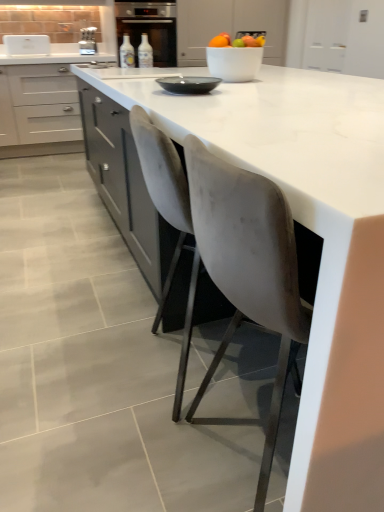
Measure the distance between white glossy toaster at upper left and camera.

They are 13.05 feet apart.

The image size is (384, 512). I want to click on matte gray cabinets at left, so click(x=41, y=102).

This screenshot has width=384, height=512. Describe the element at coordinates (145, 52) in the screenshot. I see `translucent glass bottle at center, the first bottle viewed from the right` at that location.

What do you see at coordinates (317, 234) in the screenshot?
I see `white marble countertop at center` at bounding box center [317, 234].

Describe the element at coordinates (234, 62) in the screenshot. The height and width of the screenshot is (512, 384). I see `white glossy bowl at upper center` at that location.

The width and height of the screenshot is (384, 512). What are the coordinates of `translucent glass bottle at center, the first bottle positioned from the left` in the screenshot? It's located at (127, 53).

Locate an element on the screen. white glossy toaster at upper left is located at coordinates (27, 44).

From a real-world perspective, is matte gray cabinets at left located higher than white glossy bowl at upper center?

Actually, matte gray cabinets at left is physically below white glossy bowl at upper center in the real world.

Does matte gray cabinets at left have a greater height compared to white glossy bowl at upper center?

Indeed, matte gray cabinets at left has a greater height compared to white glossy bowl at upper center.

Consider the image. How distant is matte gray cabinets at left from white glossy bowl at upper center?

matte gray cabinets at left and white glossy bowl at upper center are 8.83 feet apart from each other.

Is matte gray cabinets at left oriented towards white glossy bowl at upper center?

Yes, matte gray cabinets at left is facing white glossy bowl at upper center.

From the image's perspective, which one is positioned lower, matte gray cabinets at left or white glossy toaster at upper left?

matte gray cabinets at left, from the image's perspective.

Considering the positions of objects matte gray cabinets at left and white glossy toaster at upper left in the image provided, who is more to the left, matte gray cabinets at left or white glossy toaster at upper left?

From the viewer's perspective, white glossy toaster at upper left appears more on the left side.

Is there a large distance between matte gray cabinets at left and white glossy toaster at upper left?

matte gray cabinets at left is near white glossy toaster at upper left, not far away.

Which of these two, matte gray cabinets at left or white glossy toaster at upper left, stands taller?

matte gray cabinets at left is taller.

Does translucent glass bottle at center, the first bottle positioned from the left, lie in front of matte gray cabinets at left?

That is True.

Consider the image. Is translucent glass bottle at center, the first bottle positioned from the left, turned away from matte gray cabinets at left?

Yes.

Is translucent glass bottle at center, the first bottle positioned from the left, to the right of matte gray cabinets at left from the viewer's perspective?

Yes.

Looking at this image, from a real-world perspective, is translucent glass bottle at center, the first bottle positioned from the left, physically above matte gray cabinets at left?

Indeed, from a real-world perspective, translucent glass bottle at center, the first bottle positioned from the left, stands above matte gray cabinets at left.

Is white marble countertop at center to the right of translucent glass bottle at center, the second bottle from the right, from the viewer's perspective?

Yes, white marble countertop at center is to the right of translucent glass bottle at center, the second bottle from the right.

Considering the relative sizes of white marble countertop at center and translucent glass bottle at center, the first bottle positioned from the left, in the image provided, is white marble countertop at center smaller than translucent glass bottle at center, the first bottle positioned from the left,?

No.

Considering the sizes of objects white marble countertop at center and translucent glass bottle at center, the second bottle from the right, in the image provided, who is shorter, white marble countertop at center or translucent glass bottle at center, the second bottle from the right,?

translucent glass bottle at center, the second bottle from the right, is shorter.

From the image's perspective, between white glossy toaster at upper left and metallic silver toaster at upper left, who is located below?

From the image's view, white glossy toaster at upper left is below.

Looking at this image, does white glossy toaster at upper left appear on the left side of metallic silver toaster at upper left?

Yes.

Is white glossy toaster at upper left facing away from metallic silver toaster at upper left?

No, white glossy toaster at upper left's orientation is not away from metallic silver toaster at upper left.

Can you confirm if white glossy toaster at upper left is shorter than metallic silver toaster at upper left?

Yes, white glossy toaster at upper left is shorter than metallic silver toaster at upper left.

Does white glossy toaster at upper left appear on the left side of matte gray cabinets at left?

Yes.

Considering the sizes of white glossy toaster at upper left and matte gray cabinets at left in the image, is white glossy toaster at upper left wider or thinner than matte gray cabinets at left?

white glossy toaster at upper left is thinner than matte gray cabinets at left.

Does white glossy toaster at upper left turn towards matte gray cabinets at left?

No, white glossy toaster at upper left is not oriented towards matte gray cabinets at left.

From the image's perspective, relative to matte gray cabinets at left, is white glossy toaster at upper left above or below?

Clearly, from the image's perspective, white glossy toaster at upper left is above matte gray cabinets at left.

In terms of height, does metallic silver toaster at upper left look taller or shorter compared to translucent glass bottle at center, the second bottle from the right?

Clearly, metallic silver toaster at upper left is taller compared to translucent glass bottle at center, the second bottle from the right.

Is metallic silver toaster at upper left thinner than translucent glass bottle at center, the first bottle positioned from the left?

Incorrect, the width of metallic silver toaster at upper left is not less than that of translucent glass bottle at center, the first bottle positioned from the left.

Is point (83, 28) closer to viewer compared to point (126, 36)?

That is False.

Considering the relative positions of metallic silver toaster at upper left and translucent glass bottle at center, the second bottle from the right, in the image provided, is metallic silver toaster at upper left to the right of translucent glass bottle at center, the second bottle from the right, from the viewer's perspective?

No, metallic silver toaster at upper left is not to the right of translucent glass bottle at center, the second bottle from the right.

In order to click on cabinetry below the white glossy bowl at upper center (from a real-world perspective) in this screenshot , I will do `click(41, 102)`.

Where is `cabinetry that is in front of the white glossy toaster at upper left`? This screenshot has width=384, height=512. cabinetry that is in front of the white glossy toaster at upper left is located at coordinates (41, 102).

When comparing their distances from metallic silver toaster at upper left, does translucent glass bottle at center, the second bottle from the right, or white glossy toaster at upper left seem further?

translucent glass bottle at center, the second bottle from the right.

Estimate the real-world distances between objects in this image. Which object is closer to translucent glass bottle at center, the first bottle viewed from the right, white glossy bowl at upper center or white glossy toaster at upper left?

The object closer to translucent glass bottle at center, the first bottle viewed from the right, is white glossy bowl at upper center.

From the image, which object appears to be farther from white glossy bowl at upper center, matte gray cabinets at left or white glossy toaster at upper left?

Based on the image, white glossy toaster at upper left appears to be further to white glossy bowl at upper center.

From the picture: When comparing their distances from white glossy toaster at upper left, does white marble countertop at center or translucent glass bottle at center, the first bottle positioned from the left, seem closer?

Based on the image, translucent glass bottle at center, the first bottle positioned from the left, appears to be nearer to white glossy toaster at upper left.

Based on the photo, which object lies nearer to the anchor point translucent glass bottle at center, the second bottle from the right, translucent glass bottle at center, the first bottle viewed from the right, or white glossy bowl at upper center?

translucent glass bottle at center, the first bottle viewed from the right, is closer to translucent glass bottle at center, the second bottle from the right.

When comparing their distances from white glossy bowl at upper center, does translucent glass bottle at center, the first bottle positioned from the left, or matte black bowl at center seem closer?

Among the two, matte black bowl at center is located nearer to white glossy bowl at upper center.

Looking at the image, which one is located closer to matte black bowl at center, white glossy toaster at upper left or metallic silver toaster at upper left?

The object closer to matte black bowl at center is metallic silver toaster at upper left.

From the picture: Based on their spatial positions, is velvet grey chair at center or translucent glass bottle at center, the second bottle from the right, closer to white marble countertop at center?

Among the two, velvet grey chair at center is located nearer to white marble countertop at center.

The height and width of the screenshot is (512, 384). I want to click on tableware positioned between velvet grey chair at center and translucent glass bottle at center, the first bottle positioned from the left, from near to far, so click(x=188, y=84).

Identify the location of chair positioned between white marble countertop at center and matte gray cabinets at left from near to far. Image resolution: width=384 pixels, height=512 pixels. (168, 219).

Identify the location of tableware between white marble countertop at center and translucent glass bottle at center, the first bottle viewed from the right, along the z-axis. Image resolution: width=384 pixels, height=512 pixels. (188, 84).

Where is `tableware that lies between white glossy bowl at upper center and velvet grey chair at center from top to bottom`? The height and width of the screenshot is (512, 384). tableware that lies between white glossy bowl at upper center and velvet grey chair at center from top to bottom is located at coordinates (188, 84).